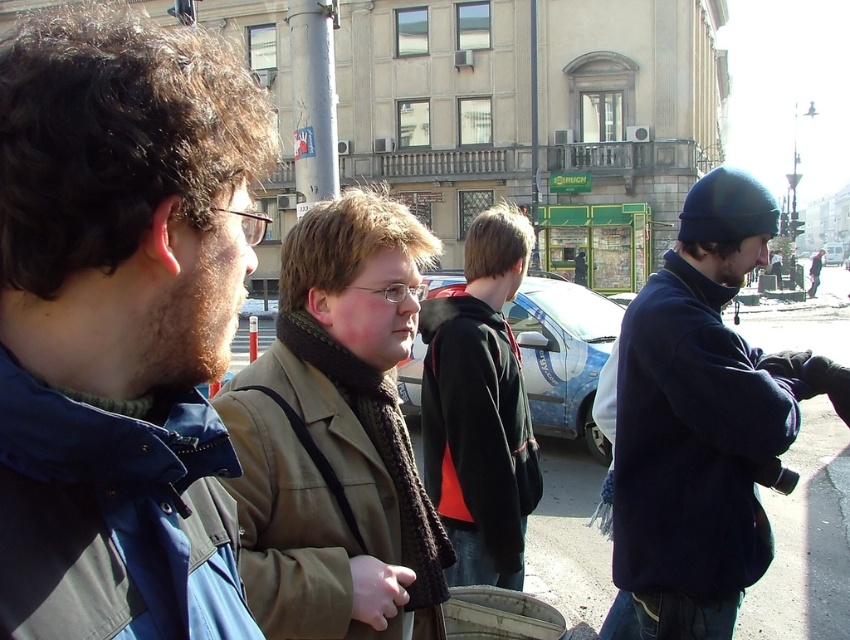
Question: Does khaki fabric jacket at center have a lesser width compared to dark green hoodie at center?

Choices:
 (A) yes
 (B) no

Answer: (A)

Question: Which point is closer to the camera?

Choices:
 (A) (820, 369)
 (B) (332, 374)
 (C) (116, 65)

Answer: (C)

Question: Can you confirm if blue fabric jacket at left is positioned to the right of khaki fabric jacket at center?

Choices:
 (A) no
 (B) yes

Answer: (A)

Question: Which of the following is the closest to the observer?

Choices:
 (A) (200, 122)
 (B) (649, 321)

Answer: (A)

Question: Among these points, which one is nearest to the camera?

Choices:
 (A) (275, 406)
 (B) (505, 488)
 (C) (85, 256)

Answer: (C)

Question: Is blue fabric jacket at left below khaki fabric jacket at center?

Choices:
 (A) no
 (B) yes

Answer: (A)